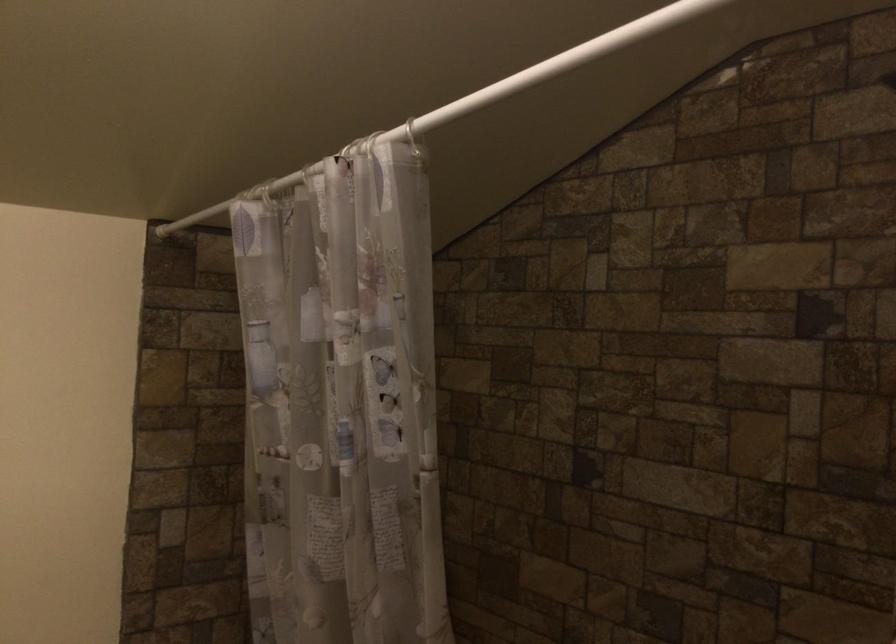
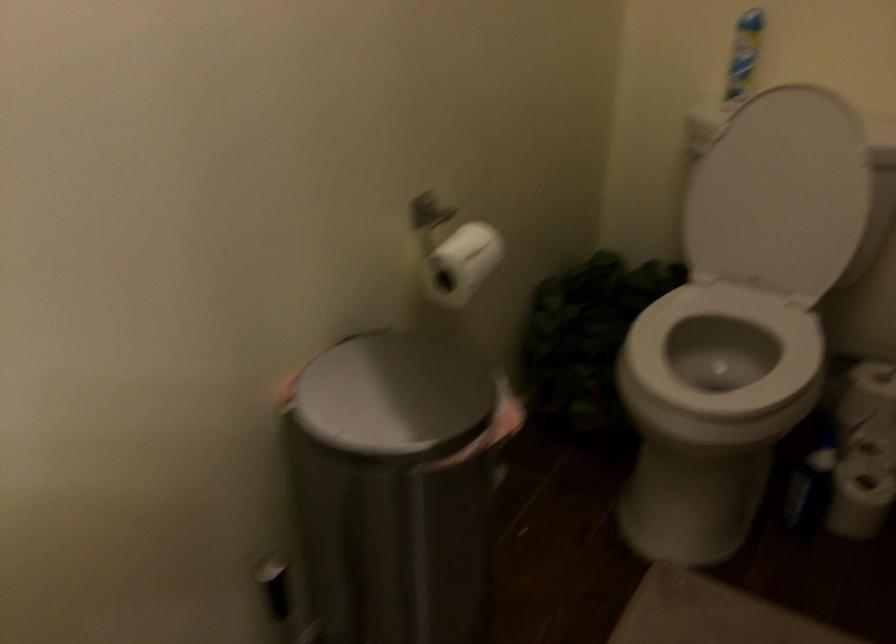
The first image is from the beginning of the video and the second image is from the end. How did the camera likely rotate when shooting the video?

The camera's rotation is toward left-down.